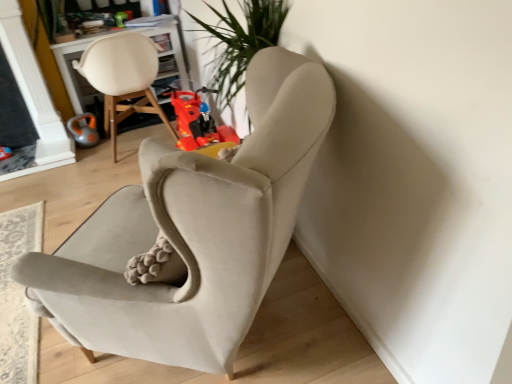
Where is `free spot in front of matte white chair at upper left, marked as the 1th chair in a left-to-right arrangement`? free spot in front of matte white chair at upper left, marked as the 1th chair in a left-to-right arrangement is located at coordinates (94, 185).